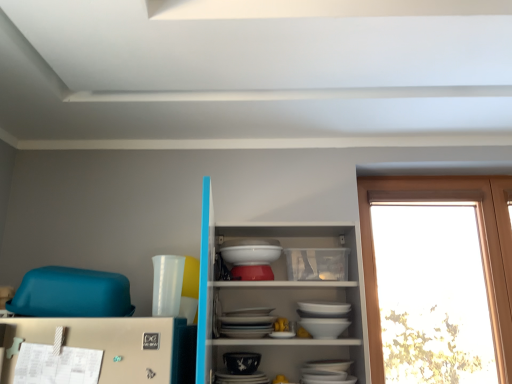
Question: Relative to white glossy bowl at center, is porcelain bowl at center in front or behind?

Choices:
 (A) front
 (B) behind

Answer: (A)

Question: Looking at their shapes, would you say porcelain bowl at center is wider or thinner than white glossy bowl at center?

Choices:
 (A) thin
 (B) wide

Answer: (A)

Question: Which object is the closest to the white glossy bowl at center?

Choices:
 (A) transparent glass window at right
 (B) white glossy bowls at center
 (C) porcelain bowl at center

Answer: (B)

Question: Based on their relative distances, which object is farther from the transparent glass window at right?

Choices:
 (A) white glossy bowl at center
 (B) porcelain bowl at center
 (C) white glossy bowls at center

Answer: (B)